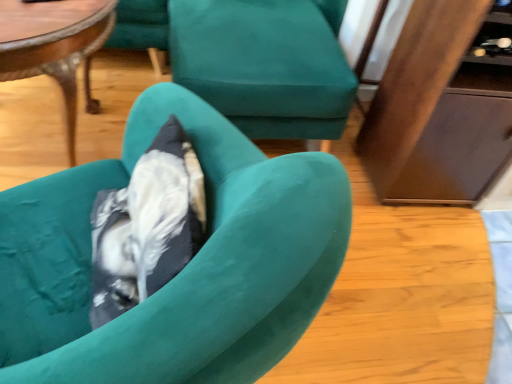
Question: Can you confirm if wooden polished coffee table at upper left is smaller than teal fabric chair at center, which is the 2th chair in front-to-back order?

Choices:
 (A) yes
 (B) no

Answer: (A)

Question: From the image's perspective, is wooden polished coffee table at upper left on teal fabric chair at center, which is the 2th chair in front-to-back order?

Choices:
 (A) no
 (B) yes

Answer: (A)

Question: Considering the relative sizes of wooden polished coffee table at upper left and teal fabric chair at center, which ranks as the 1th chair in back-to-front order, in the image provided, is wooden polished coffee table at upper left thinner than teal fabric chair at center, which ranks as the 1th chair in back-to-front order,?

Choices:
 (A) yes
 (B) no

Answer: (A)

Question: Is wooden polished coffee table at upper left next to teal fabric chair at center, which is the 2th chair in bottom-to-top order, and touching it?

Choices:
 (A) yes
 (B) no

Answer: (B)

Question: Considering the relative positions of wooden polished coffee table at upper left and teal fabric chair at center, which ranks as the 1th chair in back-to-front order, in the image provided, is wooden polished coffee table at upper left to the right of teal fabric chair at center, which ranks as the 1th chair in back-to-front order, from the viewer's perspective?

Choices:
 (A) yes
 (B) no

Answer: (B)

Question: Does point (74, 49) appear closer or farther from the camera than point (181, 306)?

Choices:
 (A) closer
 (B) farther

Answer: (B)

Question: Considering their positions, is wooden polished coffee table at upper left located in front of or behind velvet teal armchair at center, acting as the 2th chair starting from the back?

Choices:
 (A) behind
 (B) front

Answer: (A)

Question: In the image, is wooden polished coffee table at upper left on the left side or the right side of velvet teal armchair at center, positioned as the first chair in bottom-to-top order?

Choices:
 (A) left
 (B) right

Answer: (A)

Question: From a real-world perspective, is wooden polished coffee table at upper left physically located above or below velvet teal armchair at center, acting as the first chair starting from the front?

Choices:
 (A) below
 (B) above

Answer: (A)

Question: Visually, is wooden polished coffee table at upper left positioned to the left or to the right of wooden dresser at right?

Choices:
 (A) left
 (B) right

Answer: (A)

Question: Which is correct: wooden polished coffee table at upper left is inside wooden dresser at right, or outside of it?

Choices:
 (A) inside
 (B) outside

Answer: (B)

Question: Considering the positions of wooden polished coffee table at upper left and wooden dresser at right in the image, is wooden polished coffee table at upper left wider or thinner than wooden dresser at right?

Choices:
 (A) wide
 (B) thin

Answer: (A)

Question: Does point (72, 59) appear closer or farther from the camera than point (456, 130)?

Choices:
 (A) closer
 (B) farther

Answer: (A)

Question: Choose the correct answer: Is teal fabric chair at center, which is the 2th chair in front-to-back order, inside velvet teal armchair at center, acting as the first chair starting from the front, or outside it?

Choices:
 (A) inside
 (B) outside

Answer: (B)

Question: From a real-world perspective, is teal fabric chair at center, which is the 2th chair in bottom-to-top order, physically located above or below velvet teal armchair at center, acting as the 2th chair starting from the back?

Choices:
 (A) below
 (B) above

Answer: (A)